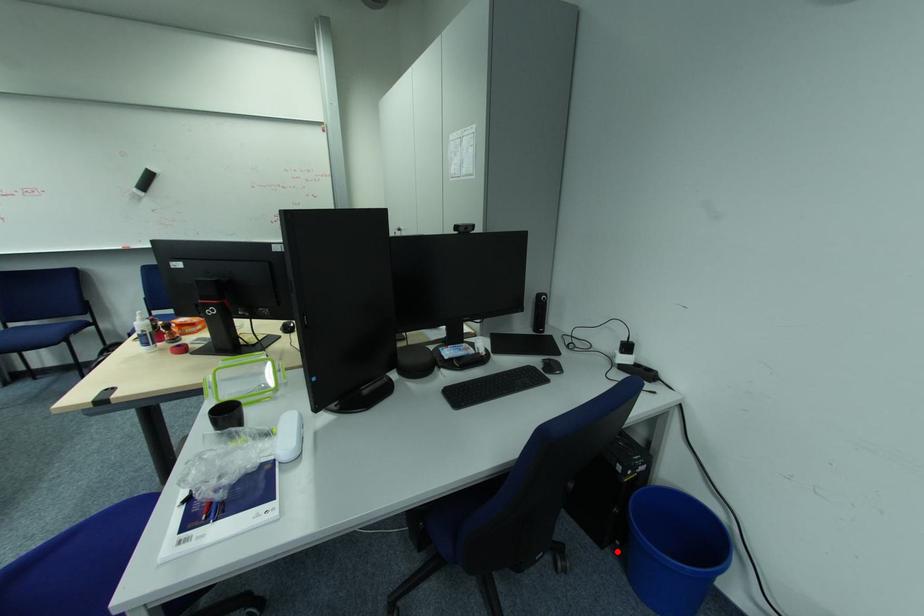
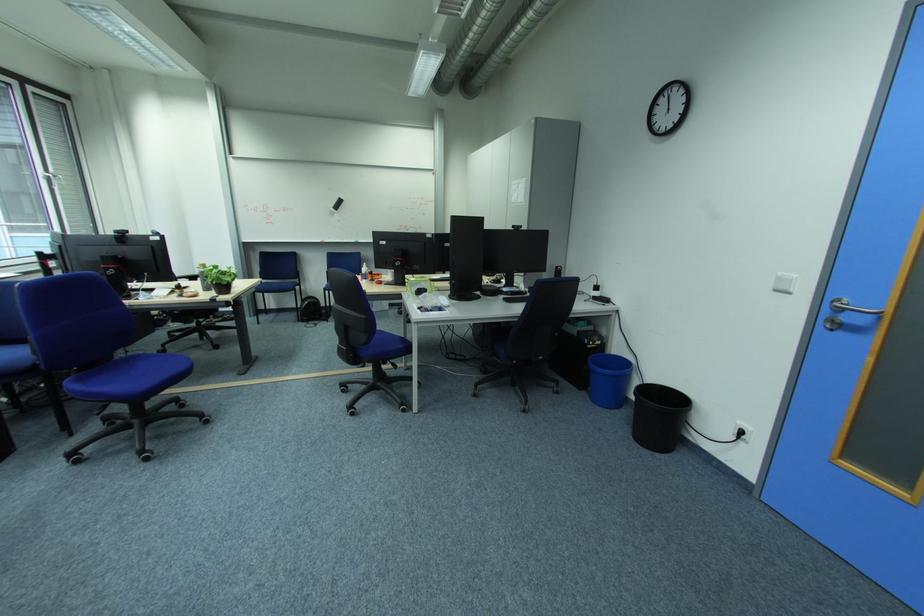
Question: I am providing you with two images of the same scene from different viewpoints. A red point is shown in image1. For the corresponding object point in image2, is it positioned nearer or farther from the camera?

Choices:
 (A) Nearer
 (B) Farther

Answer: (B)